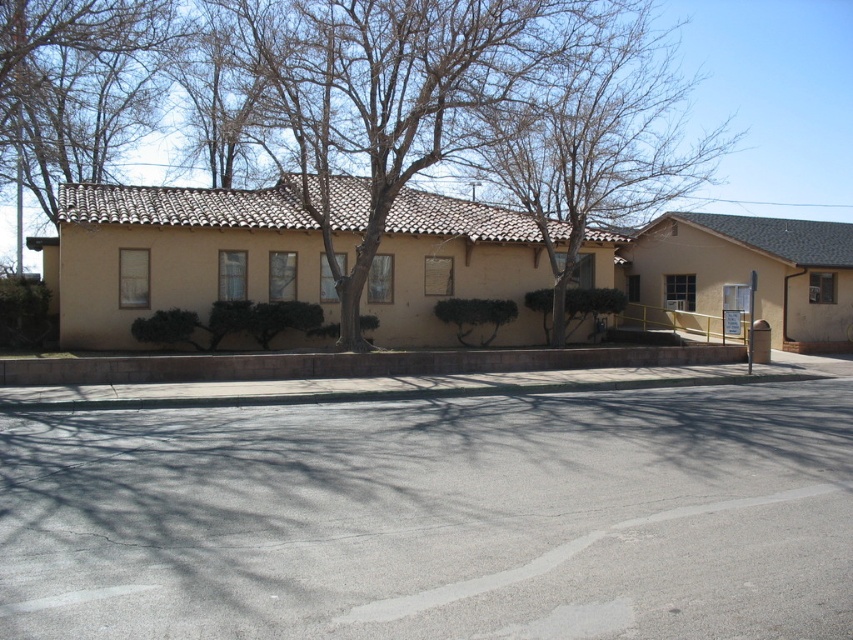
Can you confirm if bare branches at upper center is bigger than brown concrete curb at lower center?

Yes, bare branches at upper center is bigger than brown concrete curb at lower center.

Can you confirm if bare branches at upper center is positioned below brown concrete curb at lower center?

No, bare branches at upper center is not below brown concrete curb at lower center.

Who is more distant from viewer, (614, 65) or (138, 372)?

Point (614, 65)

This screenshot has height=640, width=853. I want to click on bare branches at upper center, so click(595, 138).

Is the position of bare branches at upper left more distant than that of brown concrete curb at lower center?

Yes, bare branches at upper left is further from the viewer.

Is bare branches at upper left to the right of brown concrete curb at lower center from the viewer's perspective?

No, bare branches at upper left is not to the right of brown concrete curb at lower center.

From the picture: Who is more distant from viewer, (144, 90) or (363, 362)?

Point (144, 90)

The width and height of the screenshot is (853, 640). I want to click on bare branches at upper left, so click(x=78, y=84).

Based on the photo, does bare branches at center have a greater height compared to brown concrete curb at lower center?

Indeed, bare branches at center has a greater height compared to brown concrete curb at lower center.

Is bare branches at center wider than brown concrete curb at lower center?

No, bare branches at center is not wider than brown concrete curb at lower center.

Who is more distant from viewer, (x=358, y=280) or (x=39, y=385)?

The point (x=358, y=280) is behind.

Locate an element on the screen. bare branches at center is located at coordinates (393, 90).